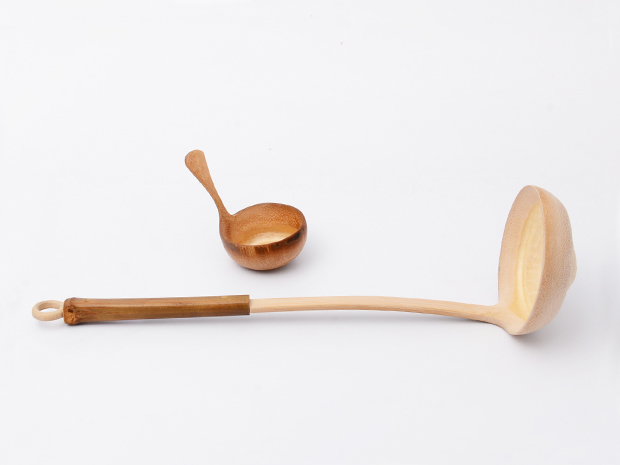
Where is `dark wood`? Image resolution: width=620 pixels, height=465 pixels. dark wood is located at coordinates (242, 250), (299, 245), (122, 309).